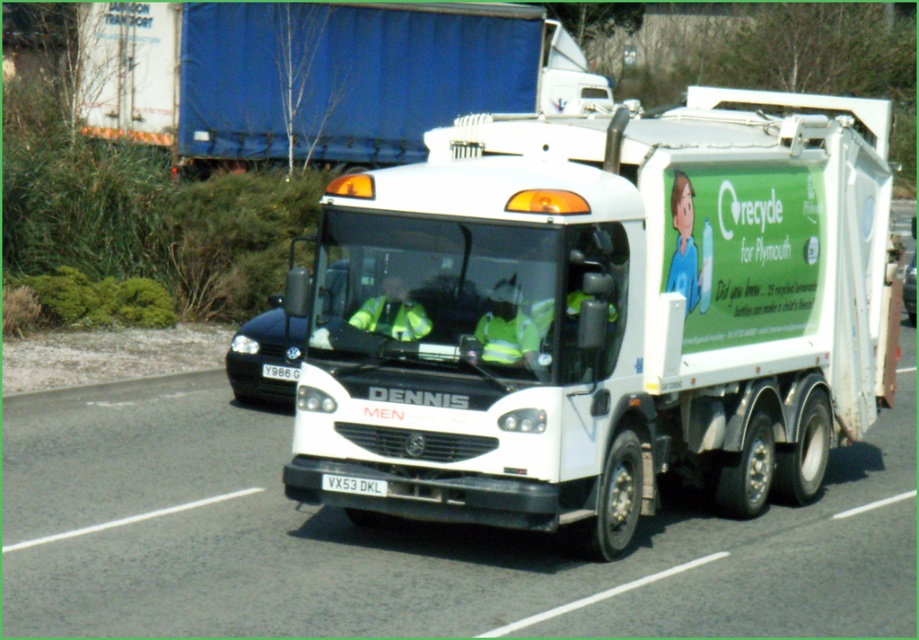
You are a safety inspector checking the visibility of safety gear on a refuse truck. You notice a reflective yellow vest at center and a high visibility reflective jacket at center. Which one is closer to the edge of the truck bed?

The reflective yellow vest at center is 54.58 centimeters from the high visibility reflective jacket at center. Since the question asks which is closer to the edge of the truck bed, the answer depends on their positions relative to the edge. However, the provided information only states their distance from each other, not their distance from the edge. Therefore, insufficient data is available to determine which is closer to the edge of the truck bed.

You are a pedestrian standing at the side of the road where the refuse collection vehicle is parked. You see both the reflective yellow vest at center and the high visibility reflective jacket at center. Which clothing item is positioned lower on your view?

The reflective yellow vest at center is below the high visibility reflective jacket at center, so the reflective yellow vest at center is positioned lower on your view.

You are a photographer taking a picture of the refuse collection vehicle. You notice two points on the truck, one at point [410,300] and another at point [911,259]. Which point will appear larger in your photo?

Point [410,300] is closer to the camera than point [911,259], so it will appear larger in the photo.